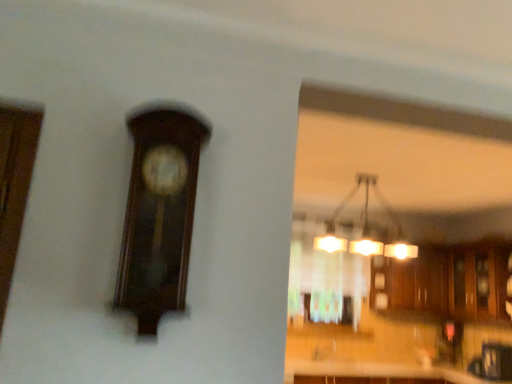
Question: Relative to translucent glass window at center, is matte glass chandelier at upper center in front or behind?

Choices:
 (A) front
 (B) behind

Answer: (A)

Question: Considering the positions of matte glass chandelier at upper center and translucent glass window at center in the image, is matte glass chandelier at upper center bigger or smaller than translucent glass window at center?

Choices:
 (A) small
 (B) big

Answer: (A)

Question: Estimate the real-world distances between objects in this image. Which object is closer to the dark wood clock at upper left?

Choices:
 (A) wooden cabinets at center
 (B) matte glass chandelier at upper center
 (C) translucent glass window at center

Answer: (C)

Question: Which of these objects is positioned closest to the wooden cabinets at center?

Choices:
 (A) translucent glass window at center
 (B) dark wood clock at upper left
 (C) matte glass chandelier at upper center

Answer: (C)